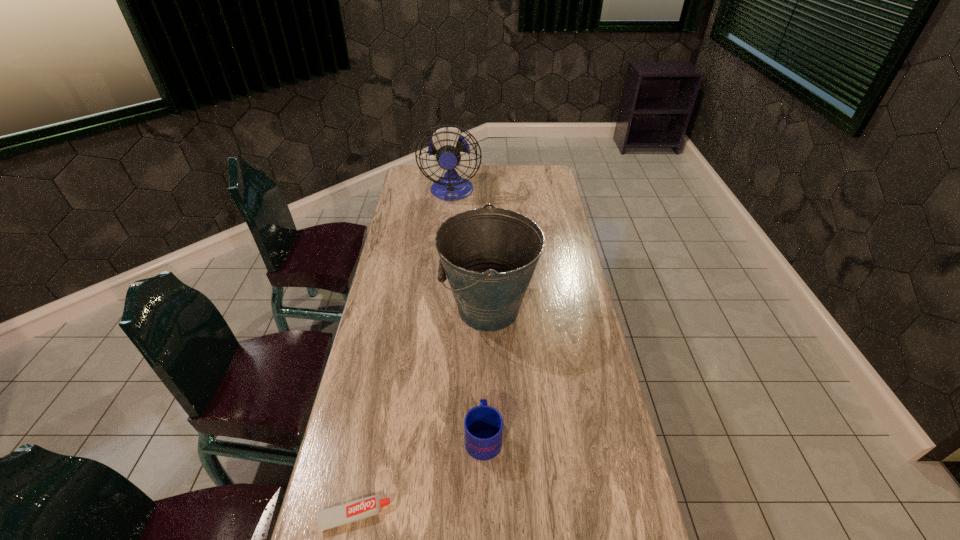
You are a GUI agent. You are given a task and a screenshot of the screen. Output one action in this format:
    pyautogui.click(x=<x>, y=<y>)
    Task: Click on the free space at the right edge of the desktop
    
    Given the screenshot: What is the action you would take?
    pyautogui.click(x=574, y=375)

This screenshot has width=960, height=540. In the image, there is a desktop. In order to click on free space at the far right corner in this screenshot , I will do `click(548, 169)`.

The image size is (960, 540). Identify the location of free spot between the shortest object and the fan. (403, 354).

Locate an element on the screen. This screenshot has width=960, height=540. free space between the toothpaste and the bucket is located at coordinates (421, 413).

Locate an element on the screen. blank region between the second farthest object and the nearest object is located at coordinates (421, 413).

The image size is (960, 540). I want to click on empty location between the nearest object and the fan, so click(403, 354).

Locate an element on the screen. empty location between the second nearest object and the toothpaste is located at coordinates (419, 476).

The width and height of the screenshot is (960, 540). I want to click on free space between the second farthest object and the second nearest object, so click(x=486, y=373).

What are the coordinates of `object that is the second nearest to the bucket` in the screenshot? It's located at (356, 510).

Find the location of a particular element. object that is the second nearest to the second nearest object is located at coordinates (489, 255).